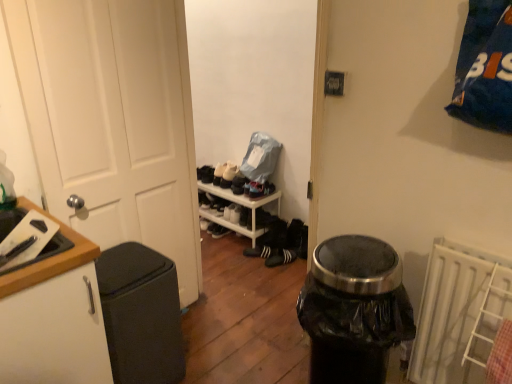
Image resolution: width=512 pixels, height=384 pixels. Find the location of `vacant region in front of white matte sneakers at center, arranged as the first footwear when viewed from the left`. vacant region in front of white matte sneakers at center, arranged as the first footwear when viewed from the left is located at coordinates (252, 261).